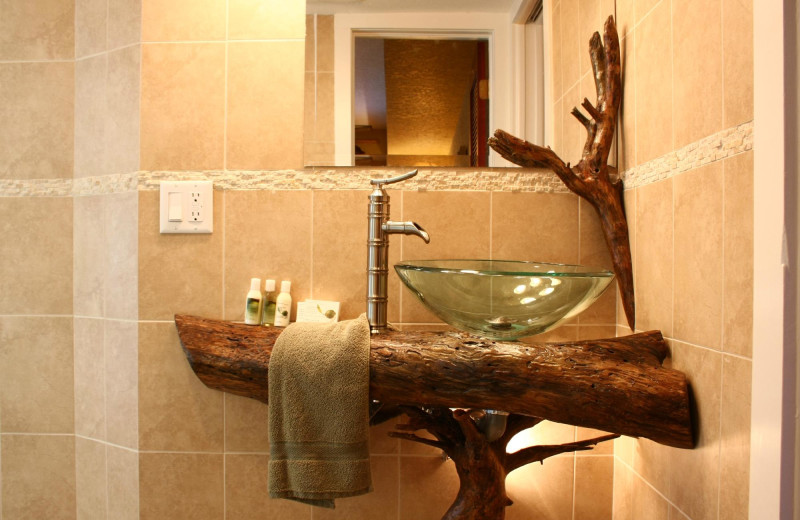
In order to click on bottle in this screenshot , I will do `click(284, 309)`, `click(266, 309)`, `click(250, 307)`.